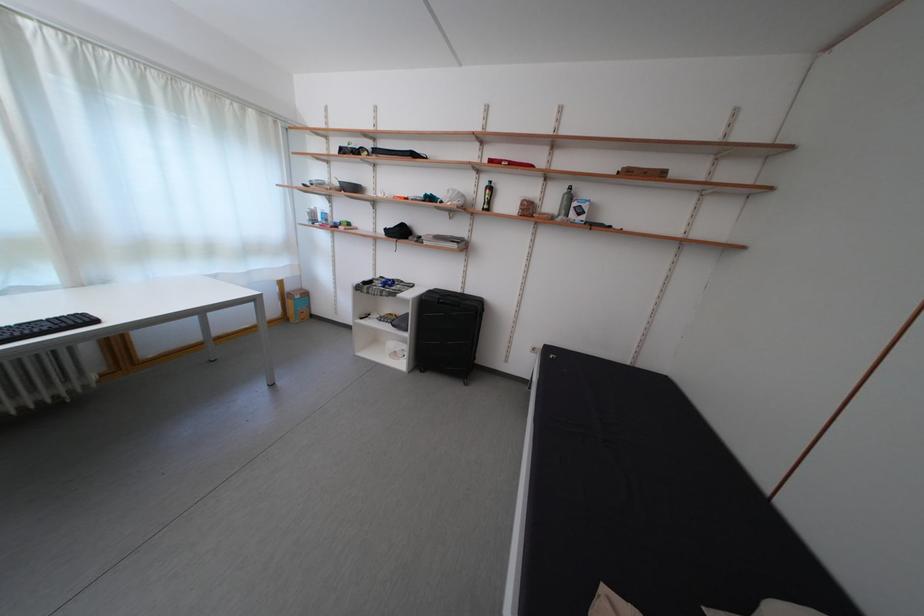
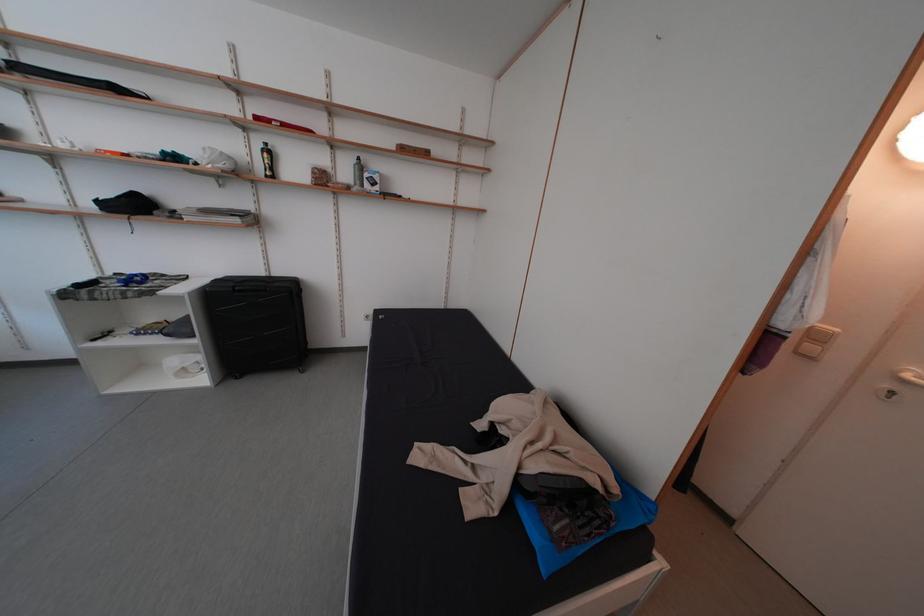
Where in the second image is the point corresponding to (465,293) from the first image?

(265, 276)